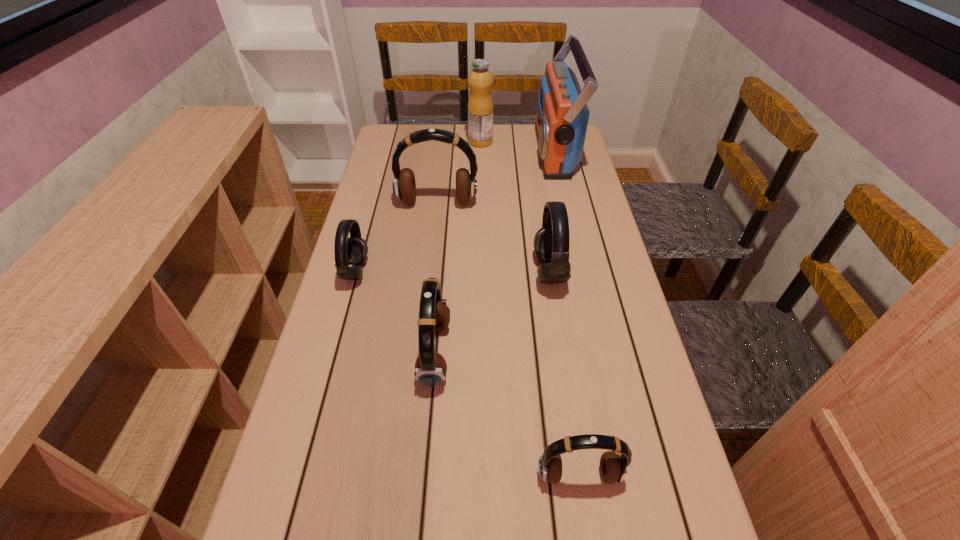
Where is `blank space at the right edge of the desktop`? The width and height of the screenshot is (960, 540). blank space at the right edge of the desktop is located at coordinates (592, 313).

The height and width of the screenshot is (540, 960). In order to click on free space between the second smallest brown headset and the farthest headset in this screenshot , I will do tap(436, 279).

Image resolution: width=960 pixels, height=540 pixels. In order to click on empty space between the third farthest object and the leftmost object in this screenshot , I will do `click(396, 237)`.

Find the location of a particular element. vacant area that lies between the smaller gray headset and the second nearest object is located at coordinates (396, 313).

What are the coordinates of `empty space between the bigger gray headset and the fifth shortest object` in the screenshot? It's located at (493, 238).

This screenshot has width=960, height=540. What are the coordinates of `free spot between the nearest headset and the fruit juice` in the screenshot? It's located at (530, 308).

Where is `free spot between the second nearest object and the third tallest object`? The width and height of the screenshot is (960, 540). free spot between the second nearest object and the third tallest object is located at coordinates (436, 279).

The height and width of the screenshot is (540, 960). Find the location of `blank region between the right gray headset and the left gray headset`. blank region between the right gray headset and the left gray headset is located at coordinates (452, 272).

You are a GUI agent. You are given a task and a screenshot of the screen. Output one action in this format:
    pyautogui.click(x=<x>, y=<y>)
    Task: Click on the object that is the third closest one to the right gray headset
    Image resolution: width=960 pixels, height=540 pixels.
    Given the screenshot: What is the action you would take?
    pyautogui.click(x=562, y=117)

Identify the location of object that ranks as the second closest to the third farthest object. The image size is (960, 540). (562, 117).